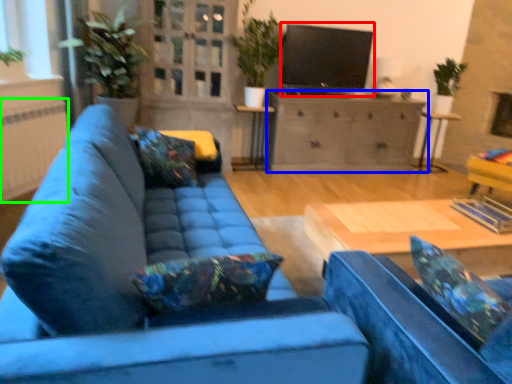
Question: Which is nearer to the open (highlighted by a red box)? cabinetry (highlighted by a blue box) or radiator (highlighted by a green box).

Choices:
 (A) cabinetry
 (B) radiator

Answer: (A)